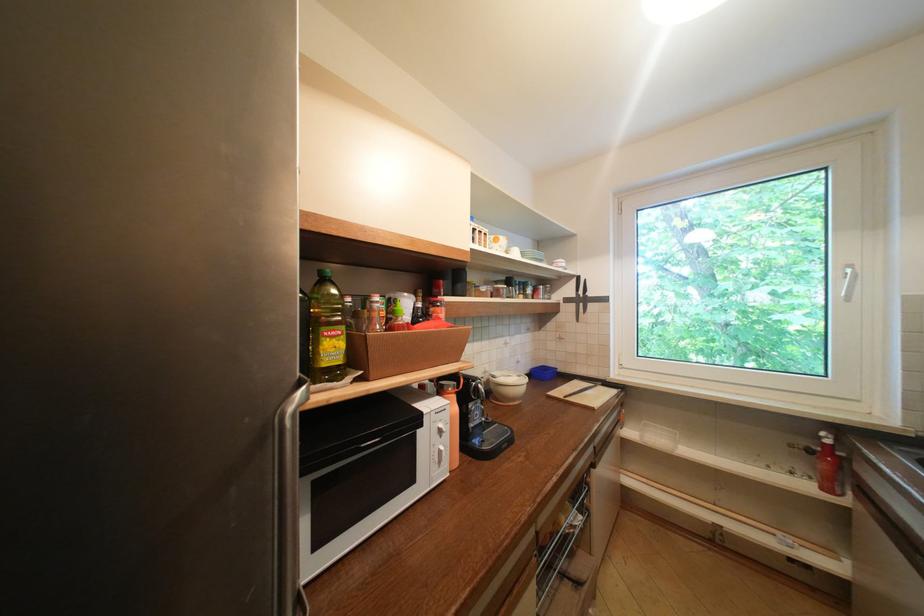
Image resolution: width=924 pixels, height=616 pixels. I want to click on white window handle, so click(848, 282).